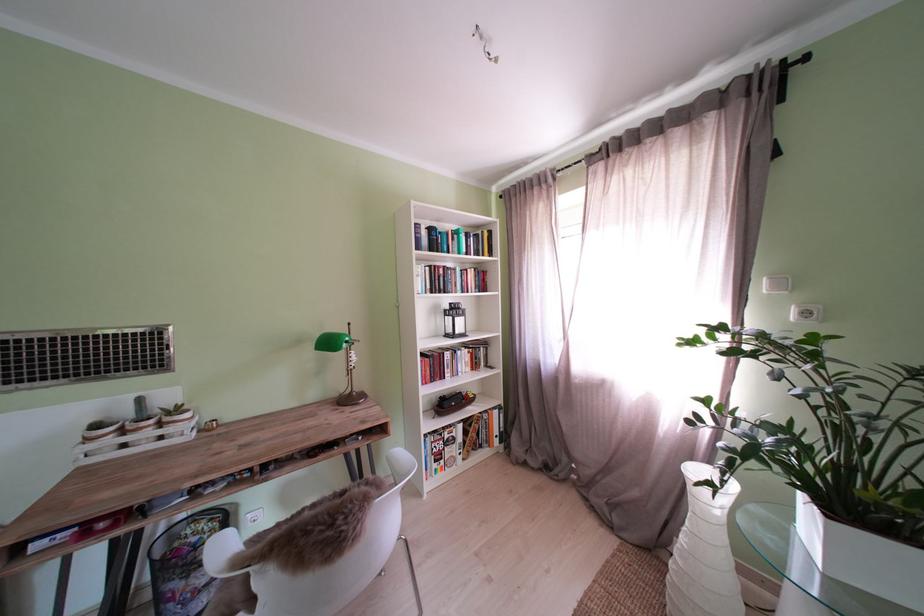
The image size is (924, 616). Find the location of `black lantern`. black lantern is located at coordinates (452, 373).